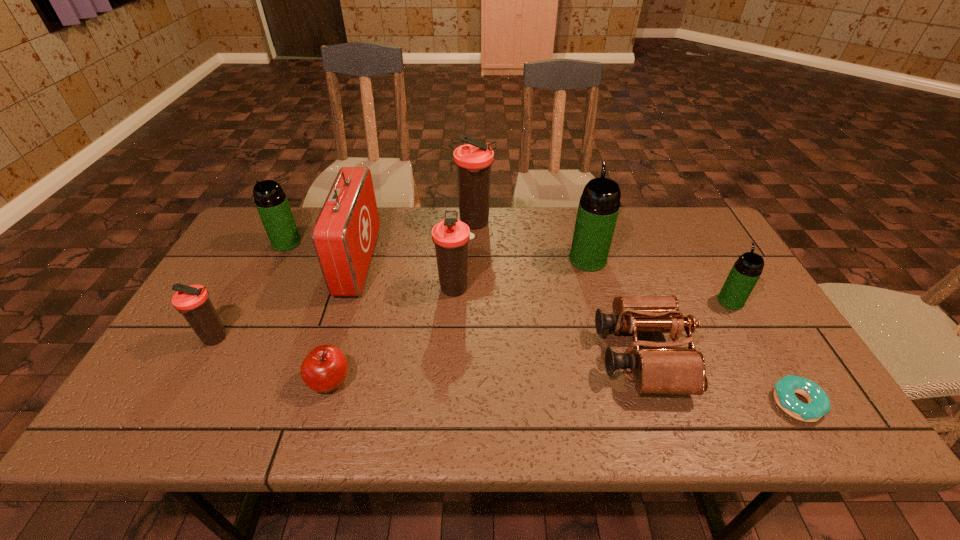
Locate an element on the screen. the biggest brown thermos bottle is located at coordinates tap(473, 161).

Image resolution: width=960 pixels, height=540 pixels. Identify the location of the second thermos bottle from right to left. (599, 205).

Find the location of a particular element. This screenshot has height=540, width=960. the biggest green thermos bottle is located at coordinates (599, 205).

The image size is (960, 540). Find the location of `red first-aid kit`. red first-aid kit is located at coordinates (344, 235).

Identify the location of the second smallest green thermos bottle. (271, 202).

What are the coordinates of `the second nearest brown thermos bottle` in the screenshot? It's located at (451, 236).

I want to click on the smallest green thermos bottle, so click(746, 271).

Image resolution: width=960 pixels, height=540 pixels. Find the location of `the rightmost thermos bottle`. the rightmost thermos bottle is located at coordinates (746, 271).

Locate an element on the screen. the smallest brown thermos bottle is located at coordinates (193, 302).

The image size is (960, 540). I want to click on the leftmost brown thermos bottle, so click(x=193, y=302).